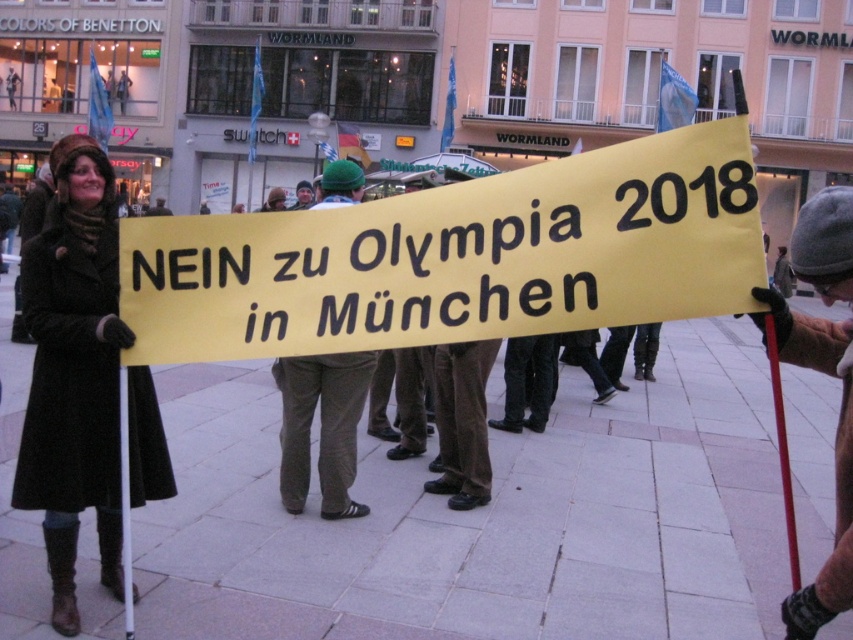
Question: Which object is the farthest from the matte black coat at left?

Choices:
 (A) gray woolen hat at right
 (B) khaki corduroy pants at center

Answer: (A)

Question: Can you confirm if matte black coat at left is positioned below gray woolen hat at right?

Choices:
 (A) no
 (B) yes

Answer: (B)

Question: Is matte black coat at left below gray woolen hat at right?

Choices:
 (A) no
 (B) yes

Answer: (B)

Question: Which point is closer to the camera taking this photo?

Choices:
 (A) (271, 368)
 (B) (300, 205)
 (C) (64, 630)

Answer: (C)

Question: Where is matte black coat at left located in relation to green knit cap at center in the image?

Choices:
 (A) below
 (B) above

Answer: (A)

Question: Which of the following is the farthest from the observer?

Choices:
 (A) green knit cap at center
 (B) gray woolen hat at right

Answer: (A)